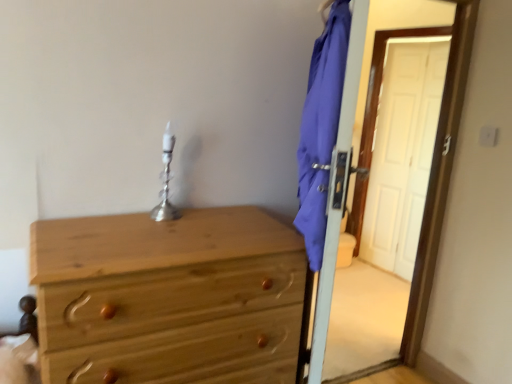
Locate an element on the screen. The width and height of the screenshot is (512, 384). free spot in front of silver metallic table lamp at center is located at coordinates (147, 228).